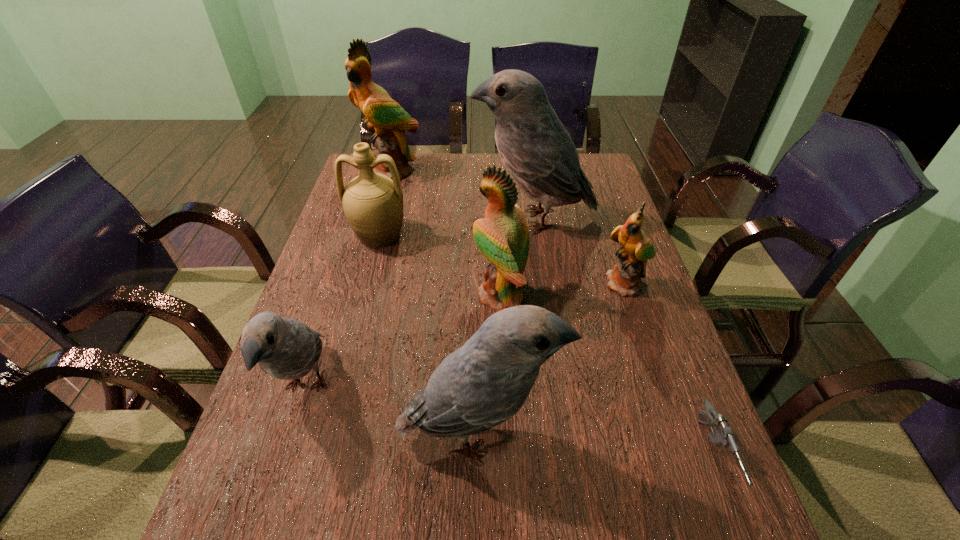
This screenshot has width=960, height=540. What are the coordinates of `parrot that stands as the third closest to the second smallest gray parrot` in the screenshot? It's located at (625, 278).

Identify the location of parrot that is the second closest to the biggest gray parrot. (502, 236).

Locate which gray parrot ranks in proximity to the rightmost green parrot. Please provide its 2D coordinates. Your answer should be formatted as a tuple, i.e. [(x, y)], where the tuple contains the x and y coordinates of a point satisfying the conditions above.

[(535, 147)]

Locate which gray parrot is the second closest to the shortest object. Please provide its 2D coordinates. Your answer should be formatted as a tuple, i.e. [(x, y)], where the tuple contains the x and y coordinates of a point satisfying the conditions above.

[(535, 147)]

Identify which green parrot is located as the nearest to the leftmost gray parrot. Please provide its 2D coordinates. Your answer should be formatted as a tuple, i.e. [(x, y)], where the tuple contains the x and y coordinates of a point satisfying the conditions above.

[(502, 236)]

Find the location of a particular element. The image size is (960, 540). green parrot that is the nearest to the farthest green parrot is located at coordinates (502, 236).

The width and height of the screenshot is (960, 540). What are the coordinates of `free location that satisfies the following two spatial constraints: 1. on the front-facing side of the farthest green parrot; 2. on the left side of the pitcher` in the screenshot? It's located at (373, 235).

Where is `free location that satisfies the following two spatial constraints: 1. on the front-facing side of the farthest parrot; 2. on the left side of the pitcher`? free location that satisfies the following two spatial constraints: 1. on the front-facing side of the farthest parrot; 2. on the left side of the pitcher is located at coordinates (373, 235).